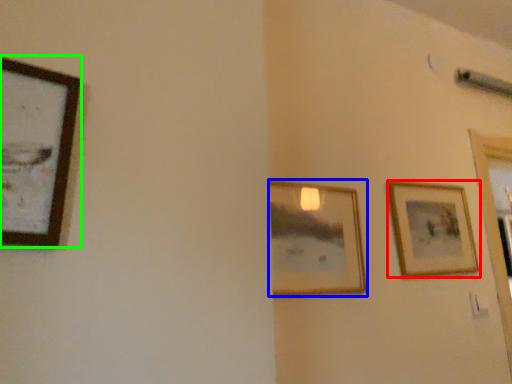
Question: Based on their relative distances, which object is nearer to picture frame (highlighted by a red box)? Choose from picture frame (highlighted by a blue box) and picture frame (highlighted by a green box).

Choices:
 (A) picture frame
 (B) picture frame

Answer: (A)